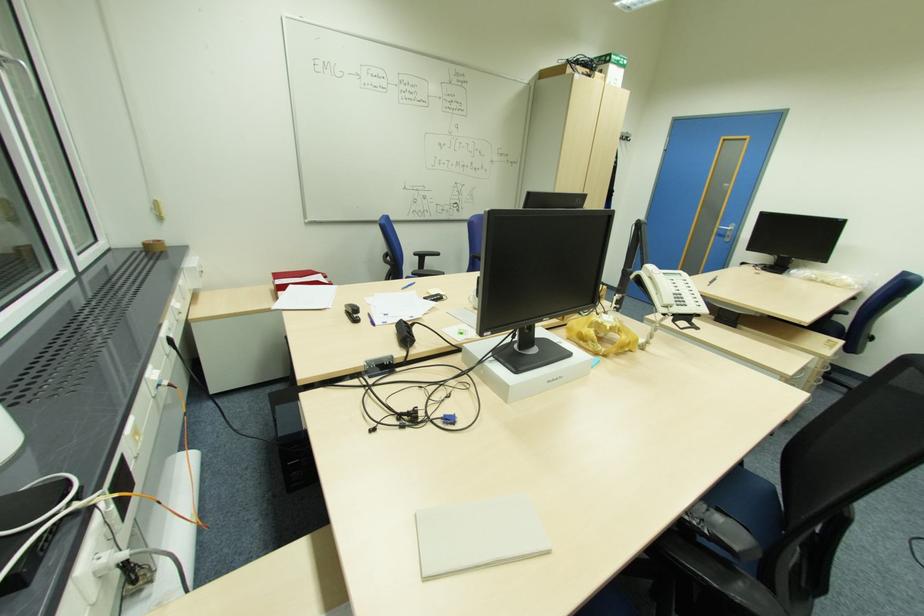
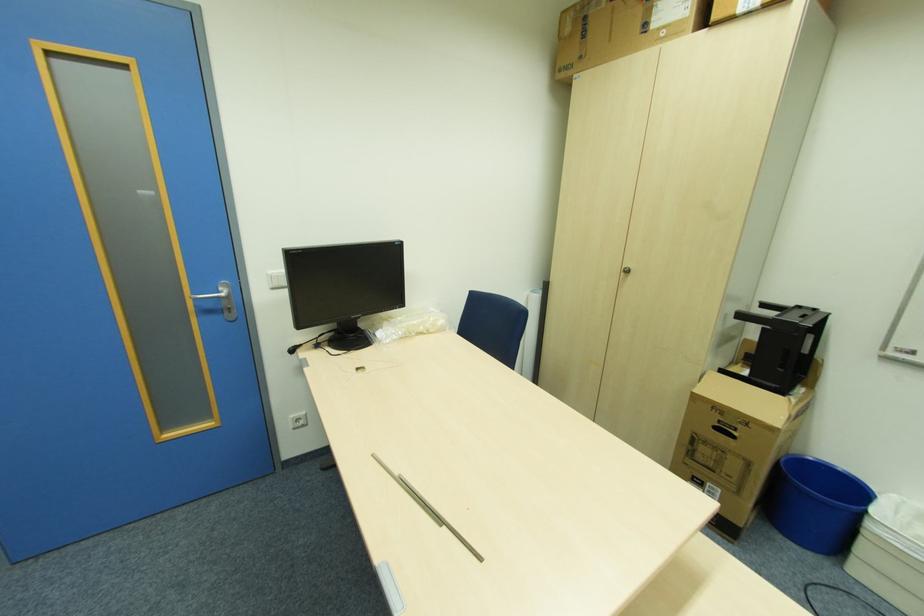
Find the pixel in the second image that matches point (831, 280) in the first image.

(424, 329)